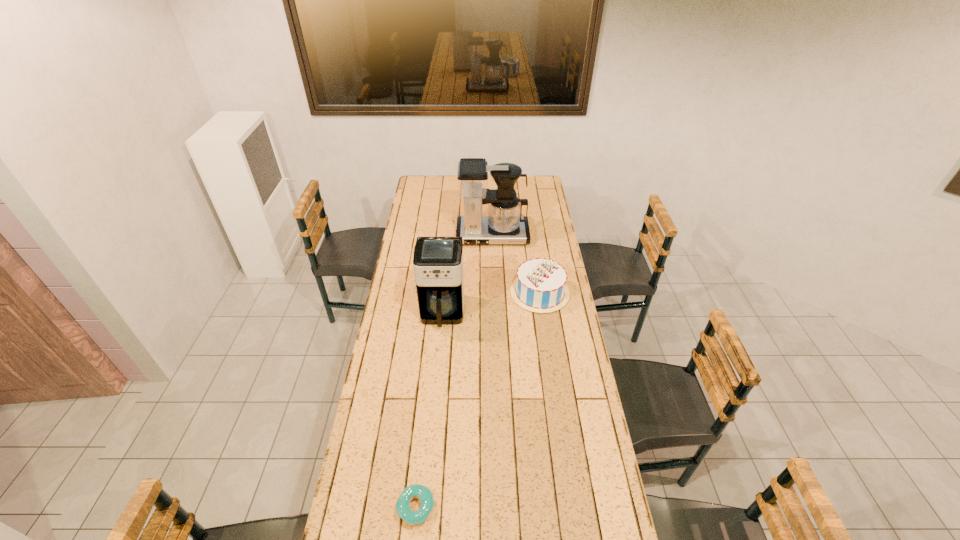
You are a GUI agent. You are given a task and a screenshot of the screen. Output one action in this format:
    pyautogui.click(x=<x>, y=<y>)
    Task: Click on the vacant area that lies between the third tallest object and the shortest object
    The width and height of the screenshot is (960, 540).
    Given the screenshot: What is the action you would take?
    pyautogui.click(x=478, y=400)

Find the location of a particular element. vacant area between the birthday cake and the nearest object is located at coordinates (478, 400).

This screenshot has width=960, height=540. Identify the location of free space between the second tallest object and the birthday cake. (492, 303).

This screenshot has height=540, width=960. I want to click on empty space that is in between the farthest object and the nearest object, so click(x=454, y=372).

What are the coordinates of `free space between the farthest object and the nearest object` in the screenshot? It's located at (454, 372).

In order to click on unoccupied position between the nearer coffee maker and the shortest object in this screenshot , I will do `click(429, 410)`.

Find the location of a particular element. blank region between the birthday cake and the farther coffee maker is located at coordinates (516, 265).

Identify the location of the second closest object to the second tallest object. The image size is (960, 540). (504, 224).

Select which object is the second closest to the shortest object. Please provide its 2D coordinates. Your answer should be formatted as a tuple, i.e. [(x, y)], where the tuple contains the x and y coordinates of a point satisfying the conditions above.

[(540, 286)]

You are a GUI agent. You are given a task and a screenshot of the screen. Output one action in this format:
    pyautogui.click(x=<x>, y=<y>)
    Task: Click on the free region that satisfies the following two spatial constraints: 1. at the front of the birthday cake where the controls are located; 2. on the left side of the farthest object
    This screenshot has height=540, width=960.
    Given the screenshot: What is the action you would take?
    pyautogui.click(x=494, y=293)